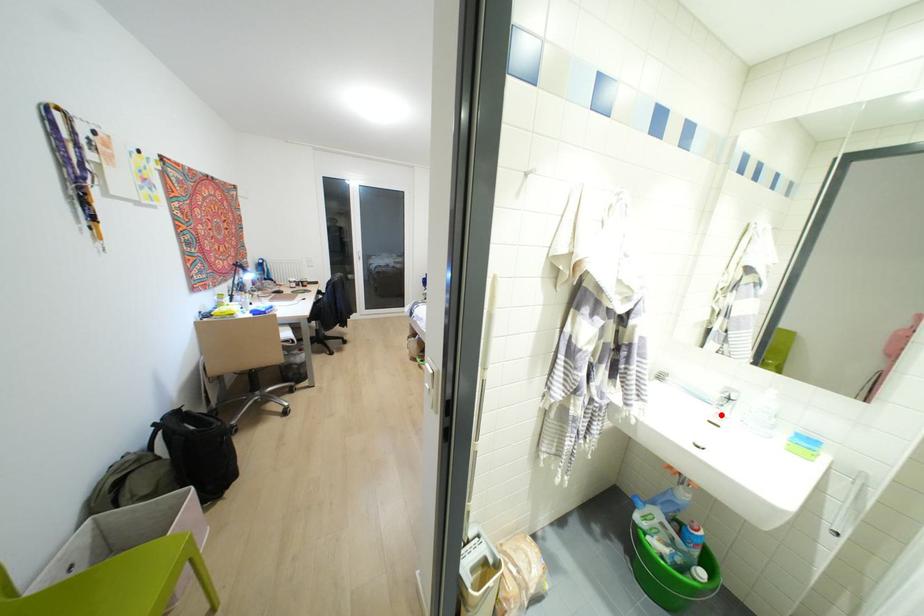
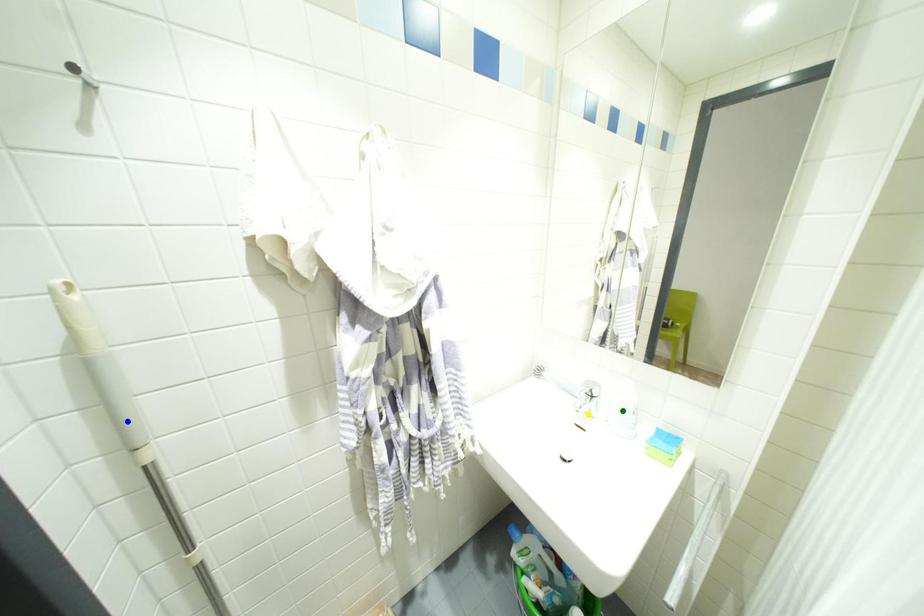
Question: I am providing you with two images of the same scene from different viewpoints. A red point is marked on the first image. You are given multiple points on the second image. Which point in image 2 represents the same 3d spot as the red point in image 1?

Choices:
 (A) green point
 (B) yellow point
 (C) blue point

Answer: (B)